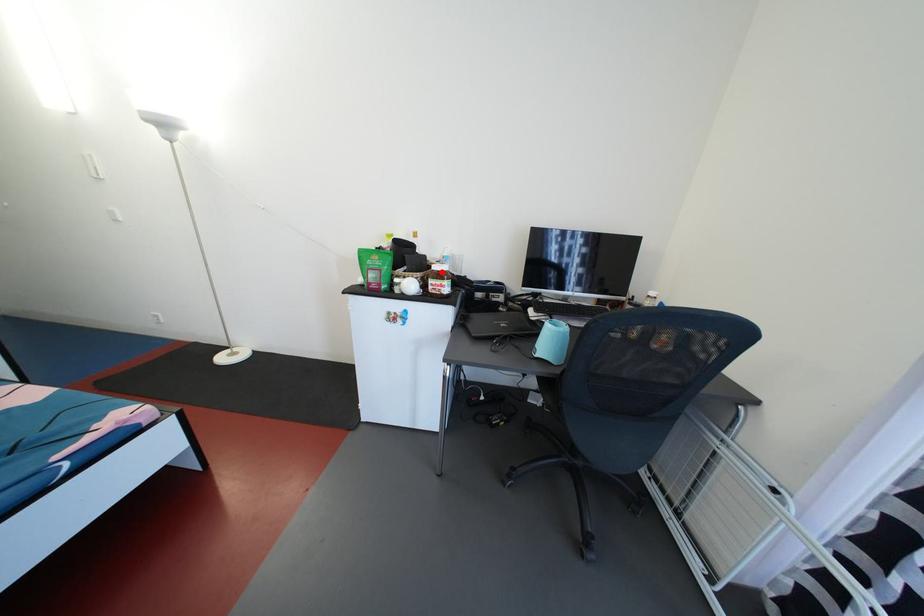
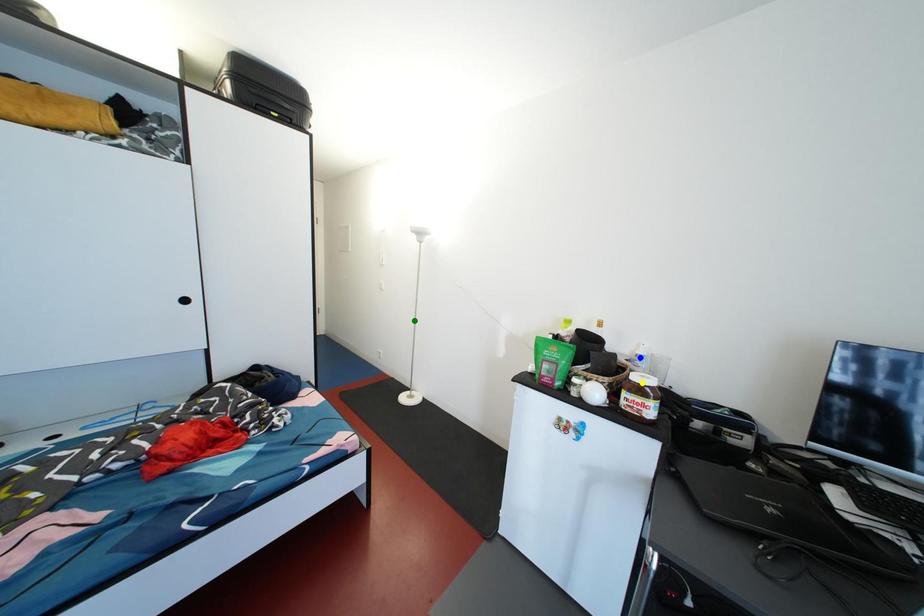
Question: I am providing you with two images of the same scene from different viewpoints. A red point is marked on the first image. You are given multiple points on the second image. Which point in image 2 represents the same 3d spot as the red point in image 1?

Choices:
 (A) green point
 (B) blue point
 (C) yellow point

Answer: (C)